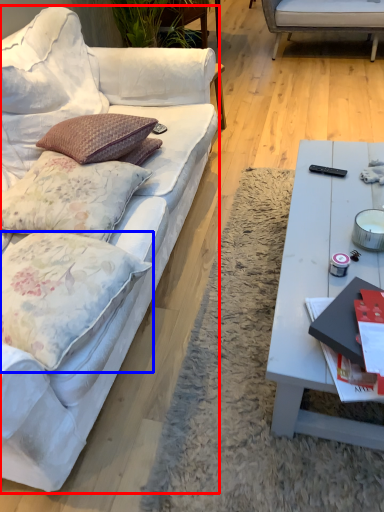
Question: Which object is closer to the camera taking this photo, studio couch (highlighted by a red box) or pillow (highlighted by a blue box)?

Choices:
 (A) studio couch
 (B) pillow

Answer: (A)